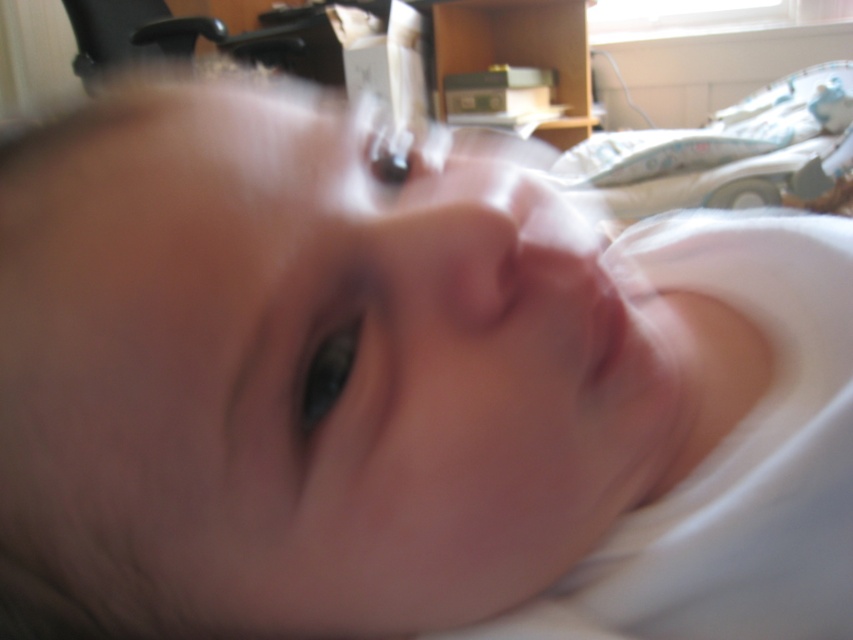
Question: Is white fabric hospital bed at upper right wider than smooth flesh mouth at center?

Choices:
 (A) no
 (B) yes

Answer: (B)

Question: Which of the following is the closest to the observer?

Choices:
 (A) (595, 218)
 (B) (614, 348)

Answer: (B)

Question: Does white fabric hospital bed at upper right appear on the left side of smooth flesh mouth at center?

Choices:
 (A) no
 (B) yes

Answer: (A)

Question: Can you confirm if white fabric hospital bed at upper right is thinner than smooth flesh mouth at center?

Choices:
 (A) no
 (B) yes

Answer: (A)

Question: Which of the following is the closest to the observer?

Choices:
 (A) (618, 355)
 (B) (837, 67)

Answer: (A)

Question: Among these objects, which one is nearest to the camera?

Choices:
 (A) smooth flesh mouth at center
 (B) white fabric hospital bed at upper right

Answer: (A)